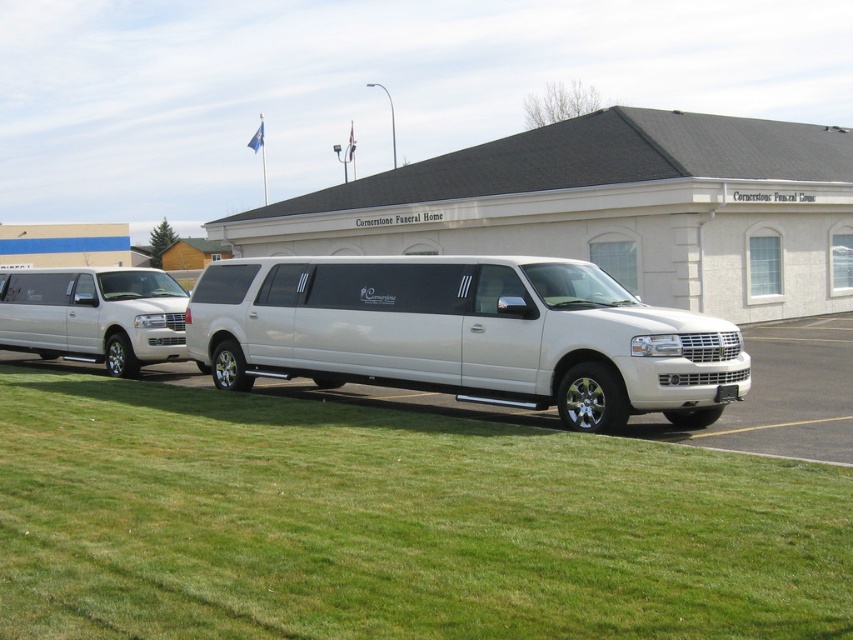
You are standing at the center of the image and want to walk towards the green grass at lower center. According to the coordinates provided, which direction should you move in?

The green grass at lower center is located at coordinates point (392,524), so you should move towards the lower center direction to reach it.

You are a photographer planning to capture the matte silver minivan at left and the green grass at lower center in the same frame. Based on their heights, which one would appear closer to the bottom of the photo?

The green grass at lower center is not as tall as the matte silver minivan at left, so it would appear closer to the bottom of the photo.